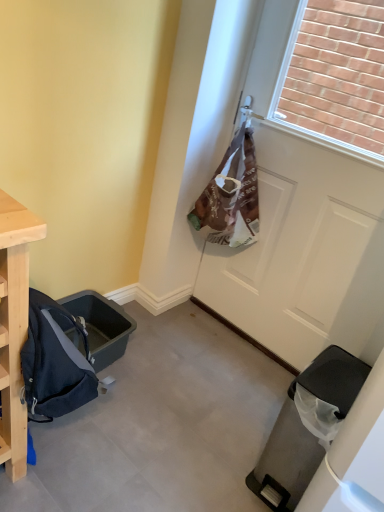
Question: Relative to black plastic trash can at lower right, is white matte door at center in front or behind?

Choices:
 (A) front
 (B) behind

Answer: (B)

Question: Looking at their shapes, would you say white matte door at center is wider or thinner than black plastic trash can at lower right?

Choices:
 (A) thin
 (B) wide

Answer: (A)

Question: Is white matte door at center bigger or smaller than black plastic trash can at lower right?

Choices:
 (A) big
 (B) small

Answer: (A)

Question: From the image's perspective, is black plastic trash can at lower right positioned above or below white matte door at center?

Choices:
 (A) below
 (B) above

Answer: (A)

Question: From a real-world perspective, is black plastic trash can at lower right physically located above or below white matte door at center?

Choices:
 (A) below
 (B) above

Answer: (A)

Question: Is black plastic trash can at lower right taller or shorter than white matte door at center?

Choices:
 (A) tall
 (B) short

Answer: (B)

Question: Considering the positions of black plastic trash can at lower right and white matte door at center in the image, is black plastic trash can at lower right bigger or smaller than white matte door at center?

Choices:
 (A) small
 (B) big

Answer: (A)